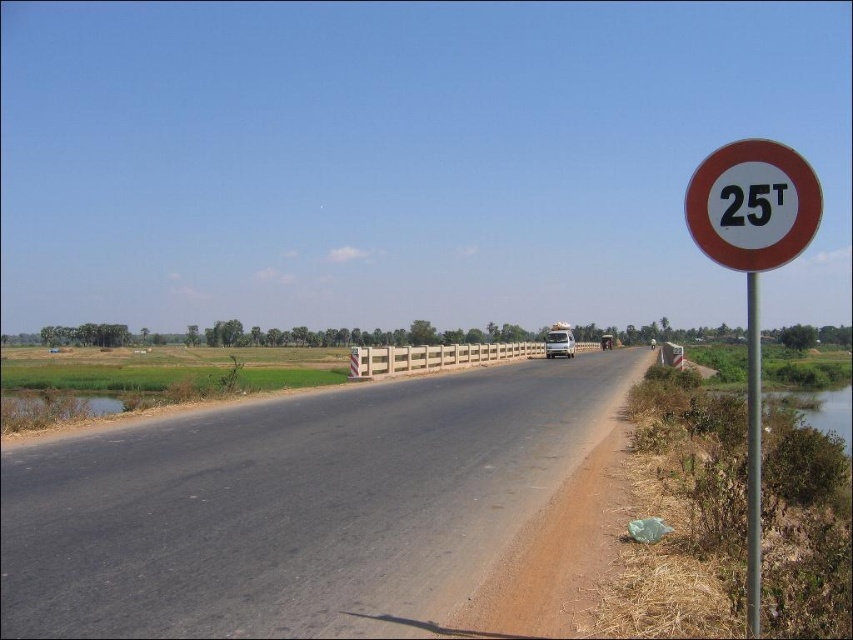
Between white circular sign at right and white matte trailer truck at center, which one is positioned lower?

white matte trailer truck at center is below.

Is white circular sign at right taller than white matte trailer truck at center?

Indeed, white circular sign at right has a greater height compared to white matte trailer truck at center.

Does point (730, 161) lie in front of point (553, 356)?

That is True.

Image resolution: width=853 pixels, height=640 pixels. In order to click on white circular sign at right in this screenshot , I will do `click(752, 204)`.

Can you confirm if black asphalt road at center is positioned to the right of white circular sign at right?

Incorrect, black asphalt road at center is not on the right side of white circular sign at right.

What are the coordinates of `black asphalt road at center` in the screenshot? It's located at (294, 506).

Which of these two, white plastic sign at right or white matte trailer truck at center, stands shorter?

With less height is white matte trailer truck at center.

Locate an element on the screen. white plastic sign at right is located at coordinates (752, 268).